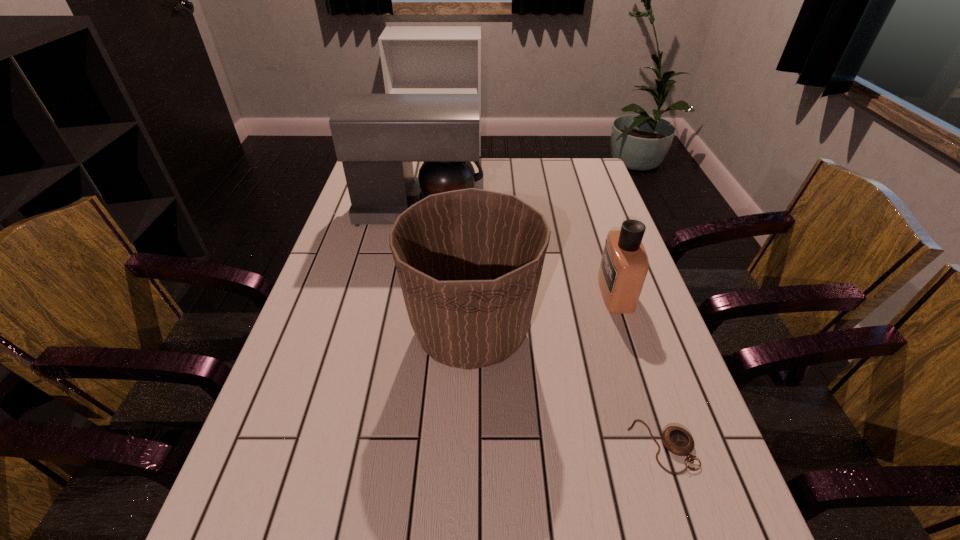
Where is `free spot between the pocket watch and the second shortest object`? free spot between the pocket watch and the second shortest object is located at coordinates pyautogui.click(x=639, y=369).

Where is `blank region between the flowerpot and the pocket watch`? The width and height of the screenshot is (960, 540). blank region between the flowerpot and the pocket watch is located at coordinates (566, 389).

Choose which object is the nearest neighbor to the second shortest object. Please provide its 2D coordinates. Your answer should be formatted as a tuple, i.e. [(x, y)], where the tuple contains the x and y coordinates of a point satisfying the conditions above.

[(469, 261)]

Image resolution: width=960 pixels, height=540 pixels. What are the coordinates of `the third closest object relative to the pocket watch` in the screenshot? It's located at (377, 137).

At what (x,y) coordinates should I click in order to perform the action: click on free point that satisfies the following two spatial constraints: 1. on the carafe side of the flowerpot; 2. on the right side of the coffee maker. Please return your answer as a coordinate pair (x, y). Image resolution: width=960 pixels, height=540 pixels. Looking at the image, I should click on (398, 332).

Locate an element on the screen. The image size is (960, 540). vacant position in the image that satisfies the following two spatial constraints: 1. on the carafe side of the nearest object; 2. on the left side of the farthest object is located at coordinates (377, 446).

Where is `vacant region that satisfies the following two spatial constraints: 1. on the back side of the flowerpot; 2. on the carafe side of the coffee maker`? This screenshot has width=960, height=540. vacant region that satisfies the following two spatial constraints: 1. on the back side of the flowerpot; 2. on the carafe side of the coffee maker is located at coordinates (474, 208).

I want to click on free space that satisfies the following two spatial constraints: 1. on the carafe side of the shortest object; 2. on the right side of the coffee maker, so click(x=377, y=446).

This screenshot has height=540, width=960. In order to click on free space that satisfies the following two spatial constraints: 1. on the carafe side of the coffee maker; 2. on the right side of the nearest object in this screenshot , I will do [377, 446].

Locate an element on the screen. free spot that satisfies the following two spatial constraints: 1. on the carafe side of the nearest object; 2. on the right side of the farthest object is located at coordinates (377, 446).